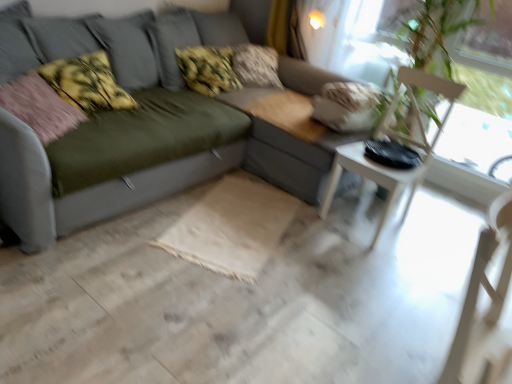
Question: From the image's perspective, is fluffy beige pillow at upper center, the first pillow from the back, located above matte gray couch at center?

Choices:
 (A) yes
 (B) no

Answer: (A)

Question: Considering the relative positions of fluffy beige pillow at upper center, the first pillow from the back, and matte gray couch at center in the image provided, is fluffy beige pillow at upper center, the first pillow from the back, to the right of matte gray couch at center from the viewer's perspective?

Choices:
 (A) no
 (B) yes

Answer: (B)

Question: Could you tell me if fluffy beige pillow at upper center, the first pillow from the back, is facing matte gray couch at center?

Choices:
 (A) no
 (B) yes

Answer: (B)

Question: From a real-world perspective, is fluffy beige pillow at upper center, the 4th pillow in the front-to-back sequence, beneath matte gray couch at center?

Choices:
 (A) no
 (B) yes

Answer: (A)

Question: Can you confirm if fluffy beige pillow at upper center, the 4th pillow in the front-to-back sequence, is thinner than matte gray couch at center?

Choices:
 (A) no
 (B) yes

Answer: (B)

Question: Is fluffy beige pillow at upper center, the first pillow from the back, looking in the opposite direction of matte gray couch at center?

Choices:
 (A) yes
 (B) no

Answer: (A)

Question: Is pink fabric pillow at left, marked as the 4th pillow in a back-to-front arrangement, looking in the opposite direction of fluffy beige pillow at upper center, the 4th pillow in the front-to-back sequence?

Choices:
 (A) yes
 (B) no

Answer: (B)

Question: Is pink fabric pillow at left, marked as the first pillow in a front-to-back arrangement, outside fluffy beige pillow at upper center, the first pillow from the back?

Choices:
 (A) yes
 (B) no

Answer: (A)

Question: Can you confirm if pink fabric pillow at left, marked as the 4th pillow in a back-to-front arrangement, is positioned to the left of fluffy beige pillow at upper center, the first pillow from the back?

Choices:
 (A) yes
 (B) no

Answer: (A)

Question: Is pink fabric pillow at left, marked as the 4th pillow in a back-to-front arrangement, aimed at fluffy beige pillow at upper center, the 4th pillow in the front-to-back sequence?

Choices:
 (A) yes
 (B) no

Answer: (B)

Question: Is pink fabric pillow at left, marked as the 4th pillow in a back-to-front arrangement, further to camera compared to fluffy beige pillow at upper center, the 4th pillow in the front-to-back sequence?

Choices:
 (A) no
 (B) yes

Answer: (A)

Question: Considering the relative sizes of pink fabric pillow at left, marked as the 4th pillow in a back-to-front arrangement, and fluffy beige pillow at upper center, the 4th pillow in the front-to-back sequence, in the image provided, is pink fabric pillow at left, marked as the 4th pillow in a back-to-front arrangement, taller than fluffy beige pillow at upper center, the 4th pillow in the front-to-back sequence,?

Choices:
 (A) no
 (B) yes

Answer: (A)

Question: Considering the relative positions of matte gray couch at center and fluffy beige pillow at upper center, the first pillow from the back, in the image provided, is matte gray couch at center to the right of fluffy beige pillow at upper center, the first pillow from the back, from the viewer's perspective?

Choices:
 (A) yes
 (B) no

Answer: (B)